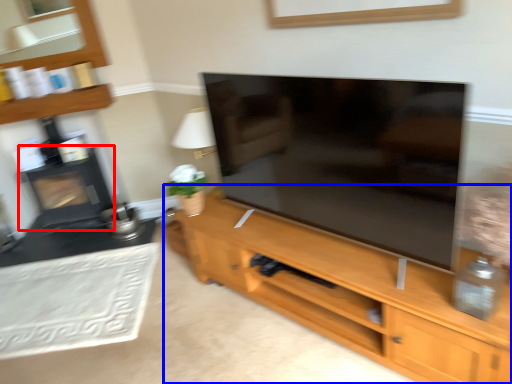
Question: Which object appears farthest to the camera in this image, fireplace (highlighted by a red box) or cupboard (highlighted by a blue box)?

Choices:
 (A) fireplace
 (B) cupboard

Answer: (A)